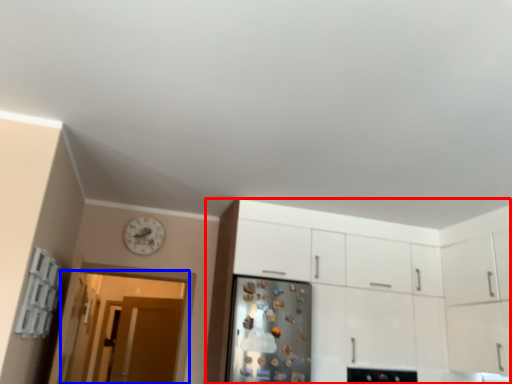
Question: Which object appears closest to the camera in this image, cabinetry (highlighted by a red box) or glass door (highlighted by a blue box)?

Choices:
 (A) cabinetry
 (B) glass door

Answer: (A)